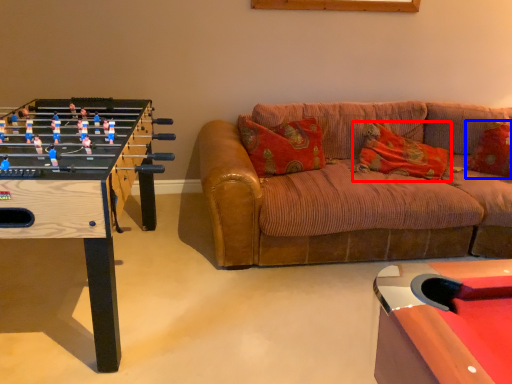
Question: Which object is closer to the camera taking this photo, pillow (highlighted by a red box) or pillow (highlighted by a blue box)?

Choices:
 (A) pillow
 (B) pillow

Answer: (A)